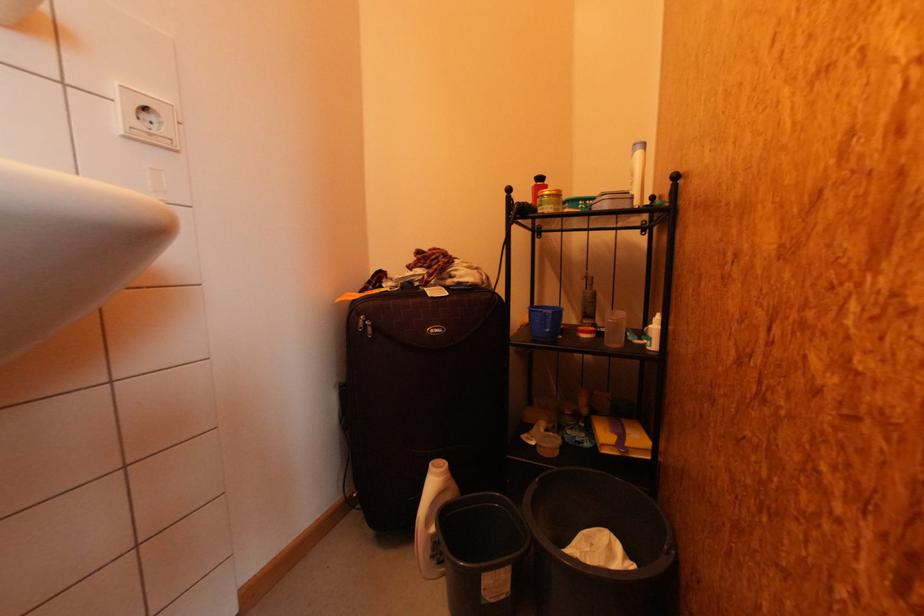
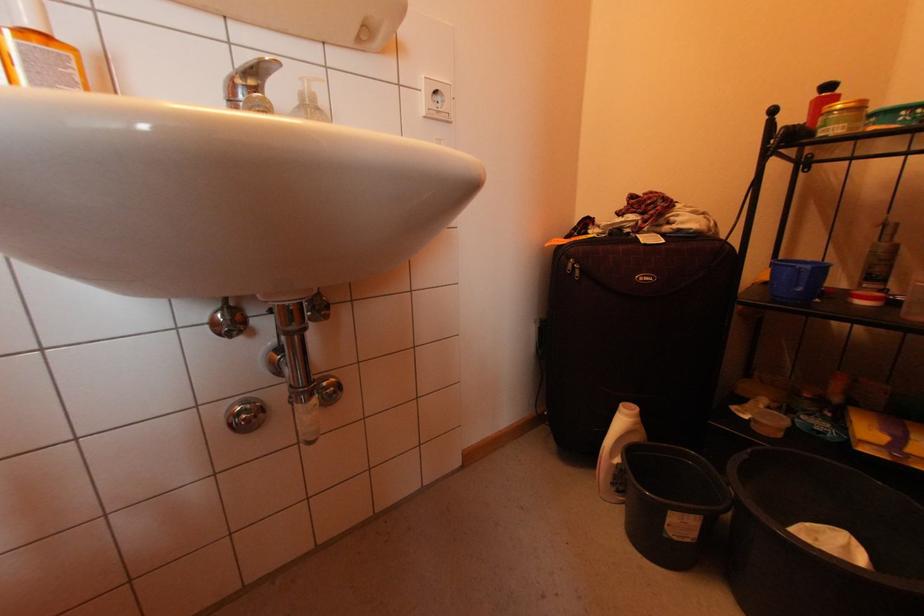
Locate, in the second image, the point that corresponds to the point at 513,589 in the first image.

(699, 536)